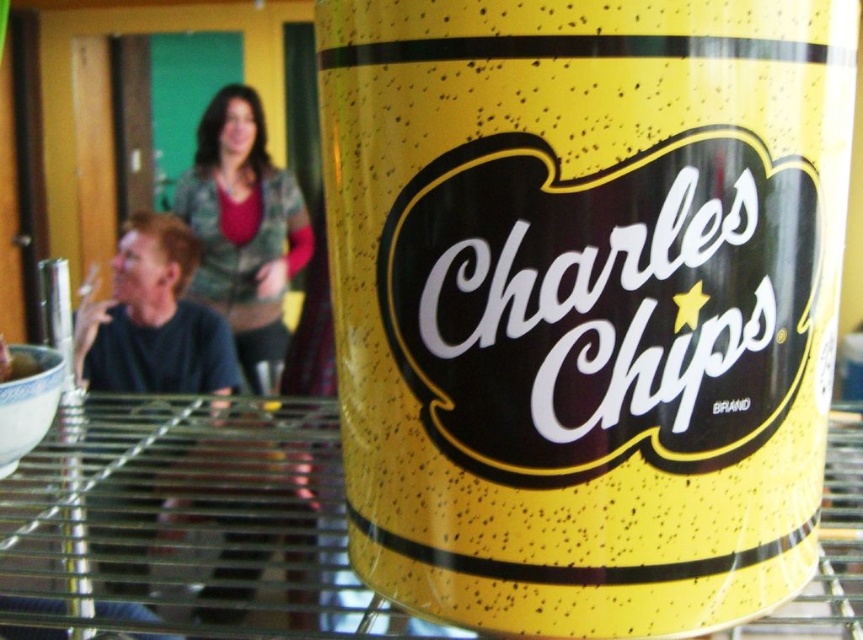
Can you confirm if yellow speckled can at center is taller than transparent glass table at center?

Correct, yellow speckled can at center is much taller as transparent glass table at center.

Image resolution: width=863 pixels, height=640 pixels. What are the coordinates of `yellow speckled can at center` in the screenshot? It's located at (584, 301).

At what (x,y) coordinates should I click in order to perform the action: click on transparent glass table at center. Please return your answer as a coordinate pair (x, y). The width and height of the screenshot is (863, 640). Looking at the image, I should click on (186, 524).

The width and height of the screenshot is (863, 640). Describe the element at coordinates (186, 524) in the screenshot. I see `transparent glass table at center` at that location.

Between point (230, 634) and point (232, 260), which one is positioned in front?

Positioned in front is point (230, 634).

The width and height of the screenshot is (863, 640). Find the location of `transparent glass table at center`. transparent glass table at center is located at coordinates (186, 524).

Is yellow speckled can at center taller than green textured sweater at upper center?

No.

Can you confirm if yellow speckled can at center is smaller than green textured sweater at upper center?

No, yellow speckled can at center is not smaller than green textured sweater at upper center.

This screenshot has height=640, width=863. Identify the location of yellow speckled can at center. (584, 301).